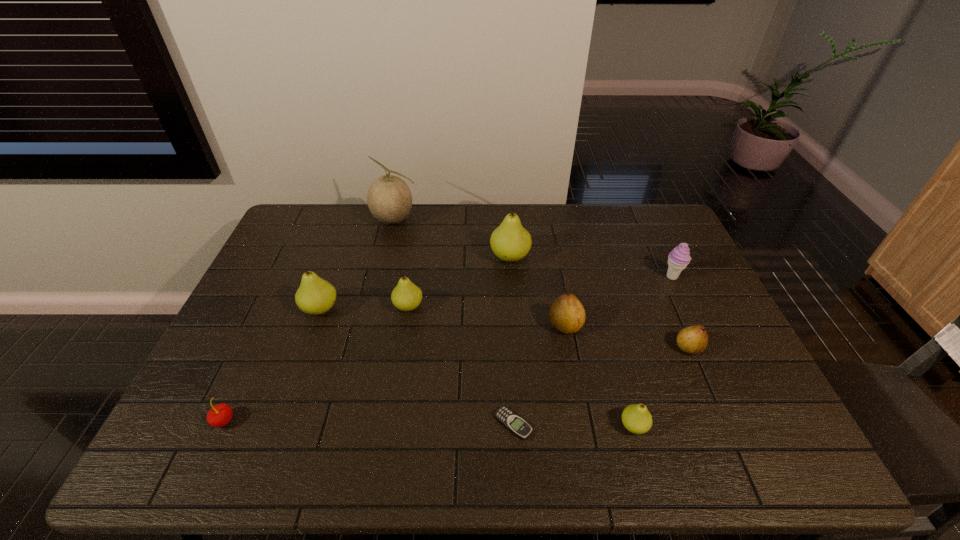
I want to click on vacant space located on the back of the fifth shortest pear, so click(x=339, y=256).

Find the location of a particular element. The image size is (960, 540). vacant space located 0.050m on the right of the purple icecream is located at coordinates (698, 276).

Find the location of a particular element. This screenshot has width=960, height=540. vacant space located on the back of the third green pear from right to left is located at coordinates (419, 246).

The height and width of the screenshot is (540, 960). Identify the location of vacant space located 0.320m on the back of the fourth pear from left to right. (550, 244).

Where is `vacant region located 0.200m on the back of the smaller brown pear`? vacant region located 0.200m on the back of the smaller brown pear is located at coordinates (662, 287).

What are the coordinates of `vacant area located 0.230m on the back of the nearest green pear` in the screenshot? It's located at (610, 338).

Locate an element on the screen. vacant area situated 0.050m on the front of the red cherry is located at coordinates (209, 453).

Locate an element on the screen. The height and width of the screenshot is (540, 960). vacant space located on the left of the beeper is located at coordinates (439, 424).

What are the coordinates of `object at the far edge` in the screenshot? It's located at (389, 198).

You are a GUI agent. You are given a task and a screenshot of the screen. Output one action in this format:
    pyautogui.click(x=<x>, y=<y>)
    Task: Click on the pear located in the near edge section of the desktop
    This screenshot has width=960, height=540.
    Given the screenshot: What is the action you would take?
    pyautogui.click(x=636, y=418)